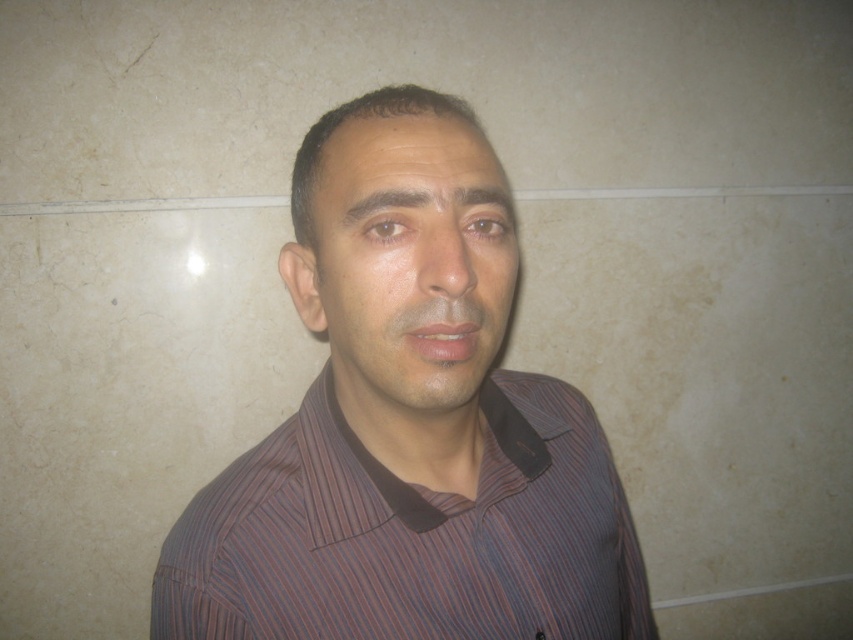
Is striped shirt at center to the left of smooth skin face at center from the viewer's perspective?

No, striped shirt at center is not to the left of smooth skin face at center.

You are a GUI agent. You are given a task and a screenshot of the screen. Output one action in this format:
    pyautogui.click(x=<x>, y=<y>)
    Task: Click on the striped shirt at center
    
    Given the screenshot: What is the action you would take?
    pos(408,424)

Between striped shirt at center and striped cotton shirt at center, which one is positioned higher?

Positioned higher is striped cotton shirt at center.

Can you confirm if striped shirt at center is smaller than striped cotton shirt at center?

Actually, striped shirt at center might be larger than striped cotton shirt at center.

You are a GUI agent. You are given a task and a screenshot of the screen. Output one action in this format:
    pyautogui.click(x=<x>, y=<y>)
    Task: Click on the striped shirt at center
    
    Given the screenshot: What is the action you would take?
    pyautogui.click(x=408, y=424)

At what (x,y) coordinates should I click in order to perform the action: click on striped shirt at center. Please return your answer as a coordinate pair (x, y). Looking at the image, I should click on (408, 424).

Is striped cotton shirt at center to the right of smooth skin face at center from the viewer's perspective?

Correct, you'll find striped cotton shirt at center to the right of smooth skin face at center.

Does striped cotton shirt at center have a greater height compared to smooth skin face at center?

Correct, striped cotton shirt at center is much taller as smooth skin face at center.

The width and height of the screenshot is (853, 640). Find the location of `striped cotton shirt at center`. striped cotton shirt at center is located at coordinates (410, 534).